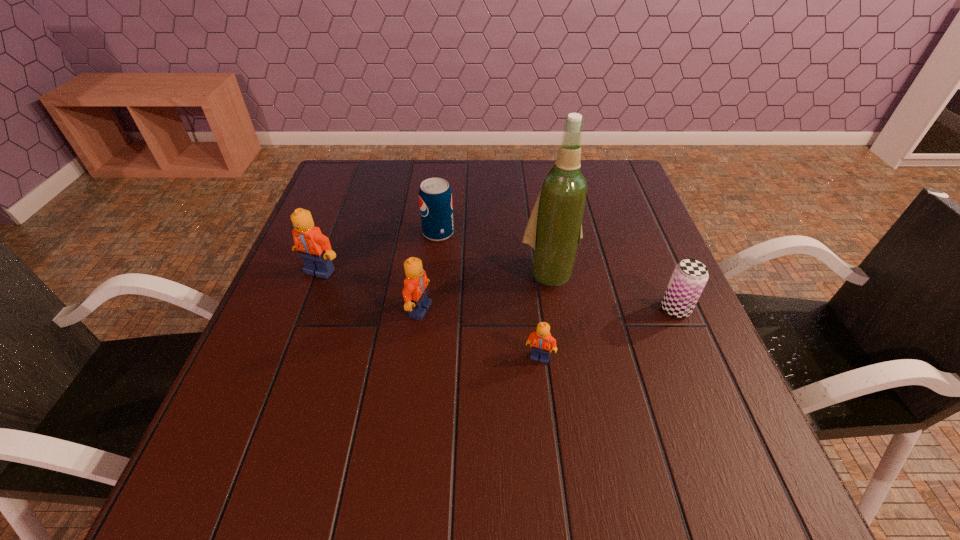
The width and height of the screenshot is (960, 540). What are the coordinates of `vacant space at the left edge of the desktop` in the screenshot? It's located at (368, 211).

At what (x,y) coordinates should I click in order to perform the action: click on vacant point at the right edge. Please return your answer as a coordinate pair (x, y). The width and height of the screenshot is (960, 540). Looking at the image, I should click on (644, 294).

The image size is (960, 540). In order to click on free space at the far left corner of the desktop in this screenshot , I will do `click(367, 202)`.

Identify the location of free space at the near left corner of the desktop. (267, 408).

In the image, there is a desktop. Where is `free space at the far right corner`? The width and height of the screenshot is (960, 540). free space at the far right corner is located at coordinates [x=589, y=173].

You are a GUI agent. You are given a task and a screenshot of the screen. Output one action in this format:
    pyautogui.click(x=<x>, y=<y>)
    Task: Click on the vacant space in between the wine bottle and the farthest object
    This screenshot has width=960, height=540.
    Given the screenshot: What is the action you would take?
    pyautogui.click(x=494, y=253)

At what (x,y) coordinates should I click in order to perform the action: click on vacant region between the nearest Lego and the leftmost object. Please return your answer as a coordinate pair (x, y). Image resolution: width=960 pixels, height=540 pixels. Looking at the image, I should click on (430, 314).

At what (x,y) coordinates should I click in order to perform the action: click on vacant area that lies between the farthest object and the farthest Lego. Please return your answer as a coordinate pair (x, y). Image resolution: width=960 pixels, height=540 pixels. Looking at the image, I should click on (379, 252).

Locate an element on the screen. Image resolution: width=960 pixels, height=540 pixels. vacant point located between the wine bottle and the second tallest Lego is located at coordinates (485, 292).

You are a GUI agent. You are given a task and a screenshot of the screen. Output one action in this format:
    pyautogui.click(x=<x>, y=<y>)
    Task: Click on the empty space between the shortest object and the second Lego from left to right
    
    Given the screenshot: What is the action you would take?
    pyautogui.click(x=480, y=334)